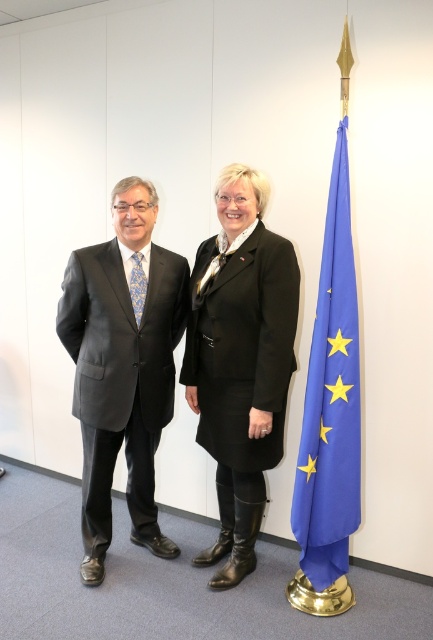
Question: Can you confirm if matte black suit at left is positioned to the right of blue fabric flag at right?

Choices:
 (A) yes
 (B) no

Answer: (B)

Question: Is the position of matte black suit at left more distant than that of black leather coat at center?

Choices:
 (A) yes
 (B) no

Answer: (A)

Question: Which point is farther from the camera taking this photo?

Choices:
 (A) (174, 257)
 (B) (230, 518)

Answer: (B)

Question: Which is nearer to the matte black suit at left?

Choices:
 (A) black leather coat at center
 (B) blue fabric flag at right

Answer: (A)

Question: Does matte black suit at left appear on the left side of blue fabric flag at right?

Choices:
 (A) no
 (B) yes

Answer: (B)

Question: Which point appears farthest from the camera in this image?

Choices:
 (A) (317, 456)
 (B) (148, 333)

Answer: (B)